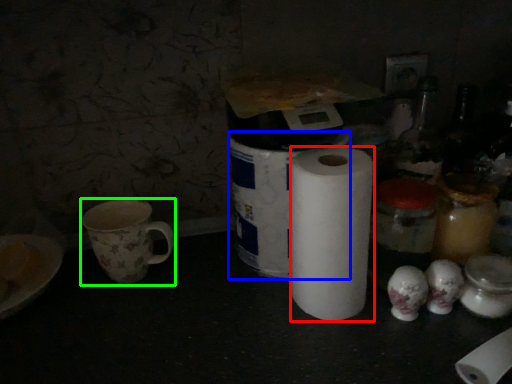
Question: Considering the real-world distances, which object is farthest from paper towel (highlighted by a red box)? toilet paper (highlighted by a blue box) or coffee cup (highlighted by a green box)?

Choices:
 (A) toilet paper
 (B) coffee cup

Answer: (B)